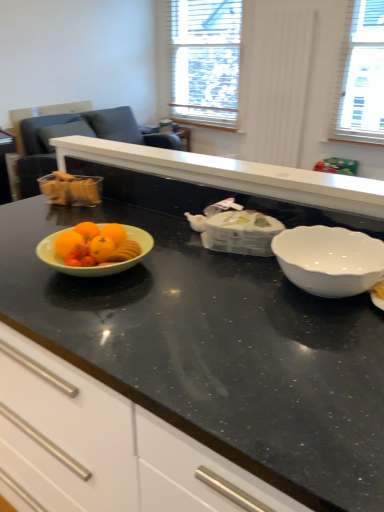
Question: Is white glossy bowl at right further to camera compared to translucent plastic container at left?

Choices:
 (A) no
 (B) yes

Answer: (A)

Question: From the image's perspective, is white glossy bowl at right above translucent plastic container at left?

Choices:
 (A) no
 (B) yes

Answer: (A)

Question: Does white glossy bowl at right appear on the right side of translucent plastic container at left?

Choices:
 (A) no
 (B) yes

Answer: (B)

Question: Does white glossy bowl at right appear on the left side of translucent plastic container at left?

Choices:
 (A) yes
 (B) no

Answer: (B)

Question: Can you confirm if white glossy bowl at right is taller than translucent plastic container at left?

Choices:
 (A) no
 (B) yes

Answer: (A)

Question: From a real-world perspective, is translucent plastic container at left physically located above or below black granite countertop at center?

Choices:
 (A) above
 (B) below

Answer: (A)

Question: Does point (76, 189) appear closer or farther from the camera than point (253, 426)?

Choices:
 (A) farther
 (B) closer

Answer: (A)

Question: Is translucent plastic container at left spatially inside black granite countertop at center, or outside of it?

Choices:
 (A) outside
 (B) inside

Answer: (B)

Question: From the image's perspective, relative to black granite countertop at center, is translucent plastic container at left above or below?

Choices:
 (A) below
 (B) above

Answer: (B)

Question: Considering the positions of point 327,256 and point 336,359, is point 327,256 closer or farther from the camera than point 336,359?

Choices:
 (A) closer
 (B) farther

Answer: (B)

Question: From the image's perspective, is white glossy bowl at right located above or below black granite countertop at center?

Choices:
 (A) below
 (B) above

Answer: (B)

Question: From their relative heights in the image, would you say white glossy bowl at right is taller or shorter than black granite countertop at center?

Choices:
 (A) tall
 (B) short

Answer: (B)

Question: Is white glossy bowl at right situated inside black granite countertop at center or outside?

Choices:
 (A) outside
 (B) inside

Answer: (B)

Question: From a real-world perspective, is white wood blinds at upper center above or below matte gray armchair at left?

Choices:
 (A) above
 (B) below

Answer: (A)

Question: Based on their sizes in the image, would you say white wood blinds at upper center is bigger or smaller than matte gray armchair at left?

Choices:
 (A) small
 (B) big

Answer: (B)